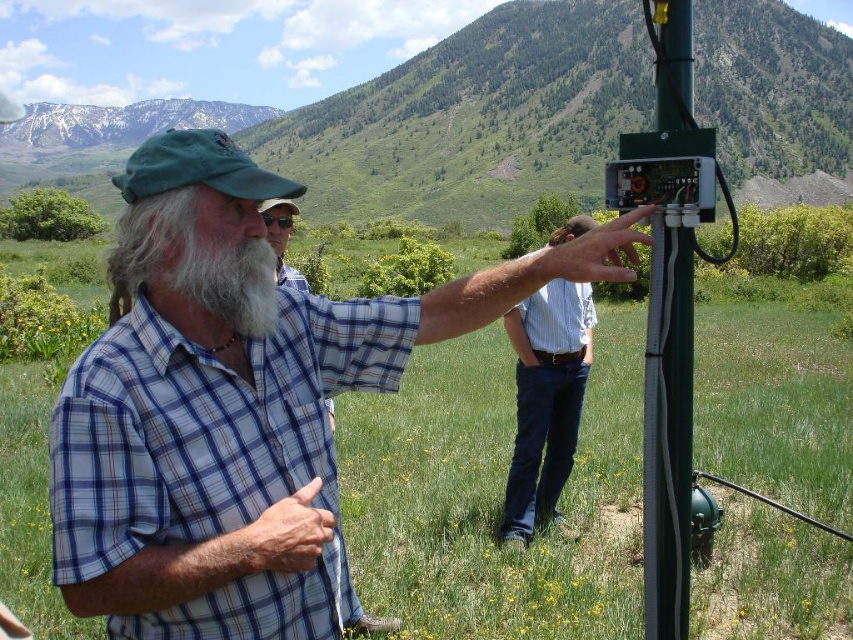
Does blue jeans at center have a lesser height compared to plaid cotton shirt at center?

Yes, blue jeans at center is shorter than plaid cotton shirt at center.

Is point (508, 509) positioned behind point (273, 218)?

Yes.

The width and height of the screenshot is (853, 640). I want to click on blue jeans at center, so click(x=544, y=400).

You are a GUI agent. You are given a task and a screenshot of the screen. Output one action in this format:
    pyautogui.click(x=<x>, y=<y>)
    Task: Click on the blue jeans at center
    This screenshot has width=853, height=640.
    Given the screenshot: What is the action you would take?
    pyautogui.click(x=544, y=400)

Is plaid shirt at center to the left of blue jeans at center from the viewer's perspective?

Correct, you'll find plaid shirt at center to the left of blue jeans at center.

Between point (178, 440) and point (534, 392), which one is positioned behind?

The point (534, 392) is behind.

Where is `plaid shirt at center`? The height and width of the screenshot is (640, 853). plaid shirt at center is located at coordinates (236, 413).

Between point (155, 611) and point (268, 260), which one is positioned in front?

Positioned in front is point (155, 611).

Can you confirm if plaid shirt at center is taller than white matte beard at center?

Yes.

Who is more distant from viewer, (x=315, y=602) or (x=271, y=282)?

Positioned behind is point (x=271, y=282).

Image resolution: width=853 pixels, height=640 pixels. What are the coordinates of `plaid shirt at center` in the screenshot? It's located at (236, 413).